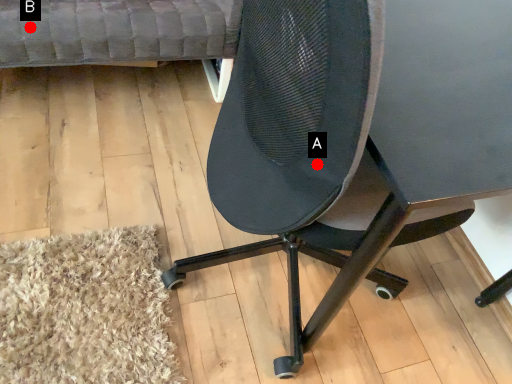
Question: Two points are circled on the image, labeled by A and B beside each circle. Among these points, which one is farthest from the camera?

Choices:
 (A) A is further
 (B) B is further

Answer: (B)